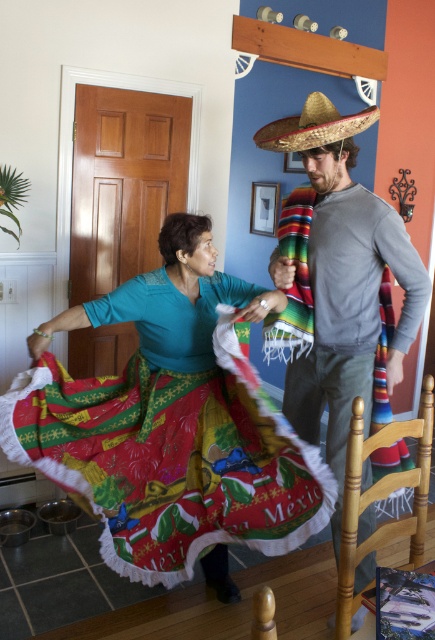
Question: Is gray cotton shirt at center below printed cotton skirt at center?

Choices:
 (A) yes
 (B) no

Answer: (A)

Question: Estimate the real-world distances between objects in this image. Which object is farther from the gray cotton shirt at center?

Choices:
 (A) printed cotton skirt at center
 (B) natural straw sombrero at upper center

Answer: (B)

Question: Is gray cotton shirt at center below natural straw sombrero at upper center?

Choices:
 (A) yes
 (B) no

Answer: (A)

Question: Can you confirm if gray cotton shirt at center is positioned above natural straw sombrero at upper center?

Choices:
 (A) yes
 (B) no

Answer: (B)

Question: Based on their relative distances, which object is nearer to the printed cotton skirt at center?

Choices:
 (A) gray cotton shirt at center
 (B) natural straw sombrero at upper center

Answer: (A)

Question: Among these points, which one is nearest to the camera?

Choices:
 (A) (218, 576)
 (B) (291, 140)
 (C) (428, 280)

Answer: (B)